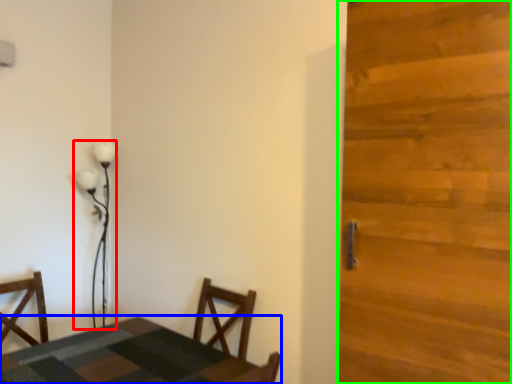
Question: Which object is positioned farthest from lamp (highlighted by a red box)? Select from table (highlighted by a blue box) and door (highlighted by a green box).

Choices:
 (A) table
 (B) door

Answer: (B)